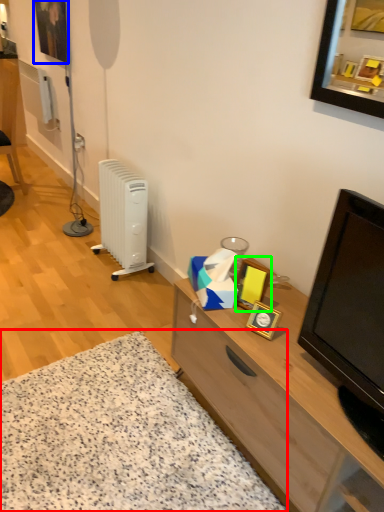
Question: Which object is the farthest from plain (highlighted by a red box)? Choose among these: picture frame (highlighted by a blue box) or picture frame (highlighted by a green box).

Choices:
 (A) picture frame
 (B) picture frame

Answer: (A)